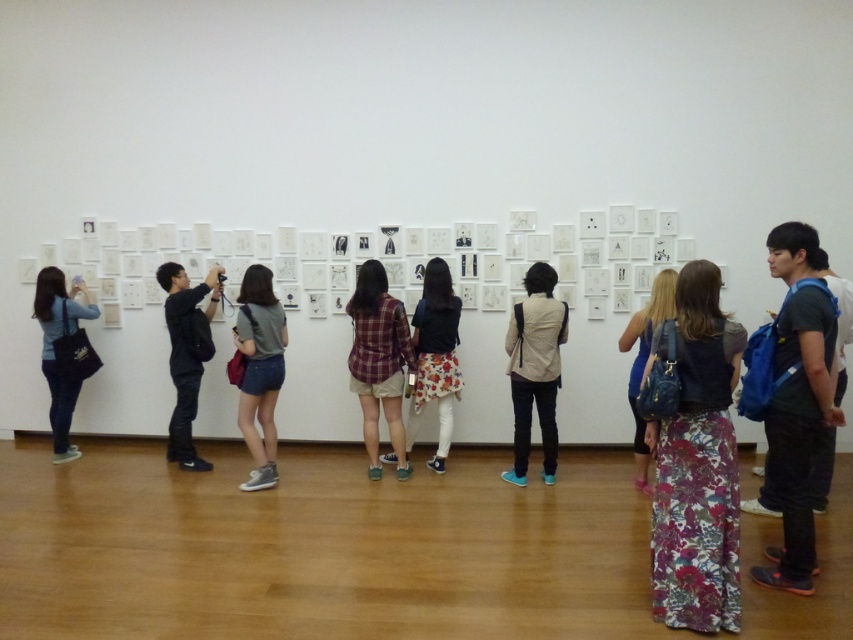
Who is positioned more to the right, beige fabric jacket at center or denim blue jeans at left?

beige fabric jacket at center is more to the right.

Who is more distant from viewer, (556, 312) or (48, 381)?

The point (48, 381) is behind.

Which is in front, point (506, 333) or point (50, 356)?

Point (506, 333)

Where is `beige fabric jacket at center`? The width and height of the screenshot is (853, 640). beige fabric jacket at center is located at coordinates (535, 369).

Can you confirm if beige fabric jacket at center is wider than plaid fabric shirt at center?

No.

Can you confirm if beige fabric jacket at center is positioned to the left of plaid fabric shirt at center?

Incorrect, beige fabric jacket at center is not on the left side of plaid fabric shirt at center.

Who is more forward, (524, 429) or (363, 278)?

Point (524, 429) is in front.

Find the location of a particular element. The image size is (853, 640). beige fabric jacket at center is located at coordinates (535, 369).

Does plaid fabric shirt at center have a larger size compared to floral dress at center?

No, plaid fabric shirt at center is not bigger than floral dress at center.

This screenshot has height=640, width=853. What do you see at coordinates (378, 362) in the screenshot?
I see `plaid fabric shirt at center` at bounding box center [378, 362].

This screenshot has width=853, height=640. I want to click on plaid fabric shirt at center, so click(378, 362).

What are the coordinates of `plaid fabric shirt at center` in the screenshot? It's located at (378, 362).